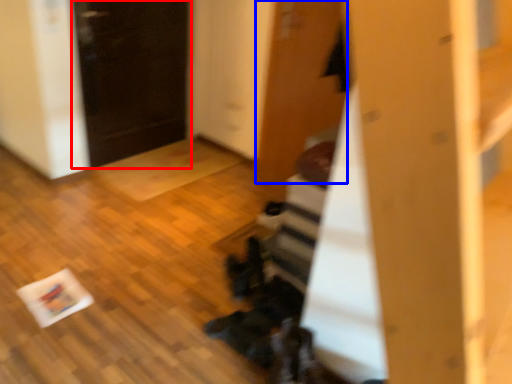
Question: Which point is closer to the camera, door (highlighted by a red box) or door (highlighted by a blue box)?

Choices:
 (A) door
 (B) door

Answer: (B)